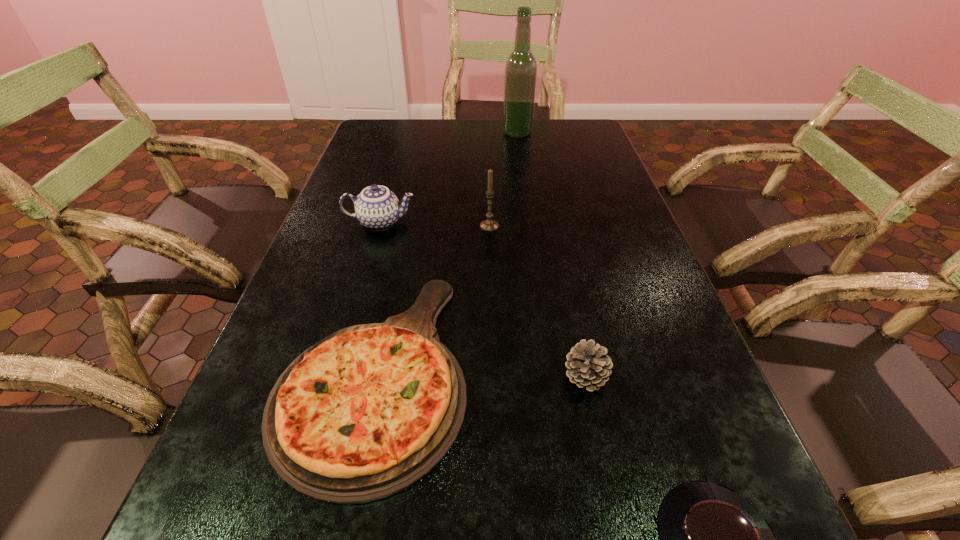
Locate an element on the screen. blank space located 0.050m on the right of the pinecone is located at coordinates (636, 376).

In order to click on vacant space located on the back of the pizza in this screenshot , I will do pyautogui.click(x=408, y=215).

You are a GUI agent. You are given a task and a screenshot of the screen. Output one action in this format:
    pyautogui.click(x=<x>, y=<y>)
    Task: Click on the object at the far edge
    Image resolution: width=960 pixels, height=540 pixels.
    Given the screenshot: What is the action you would take?
    pyautogui.click(x=520, y=78)

Locate an element on the screen. The height and width of the screenshot is (540, 960). chinaware situated at the left edge is located at coordinates (376, 207).

Locate an element on the screen. Image resolution: width=960 pixels, height=540 pixels. pizza at the left edge is located at coordinates (366, 412).

You are a GUI agent. You are given a task and a screenshot of the screen. Output one action in this format:
    pyautogui.click(x=<x>, y=<y>)
    Task: Click on the free region at the far edge of the desktop
    The width and height of the screenshot is (960, 540).
    Given the screenshot: What is the action you would take?
    pyautogui.click(x=418, y=144)

The height and width of the screenshot is (540, 960). Find the location of `blank space at the left edge of the desktop`. blank space at the left edge of the desktop is located at coordinates (329, 233).

Where is `free space at the right edge`? This screenshot has width=960, height=540. free space at the right edge is located at coordinates (583, 176).

Identify the location of vacant space at the far left corner of the desktop. The height and width of the screenshot is (540, 960). (364, 136).

Locate an element on the screen. vacant region between the pizza and the fourth tallest object is located at coordinates (480, 373).